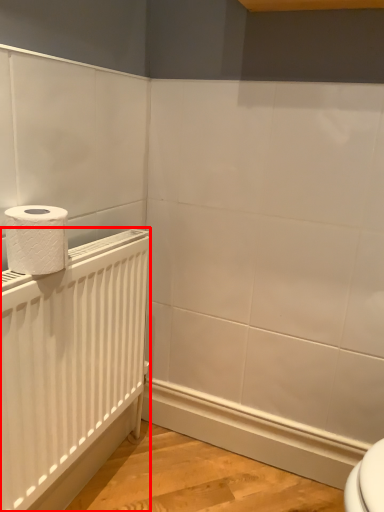
Question: Considering the relative positions of radiator (annotated by the red box) and toilet paper in the image provided, where is radiator (annotated by the red box) located with respect to the staircase?

Choices:
 (A) left
 (B) right

Answer: (B)